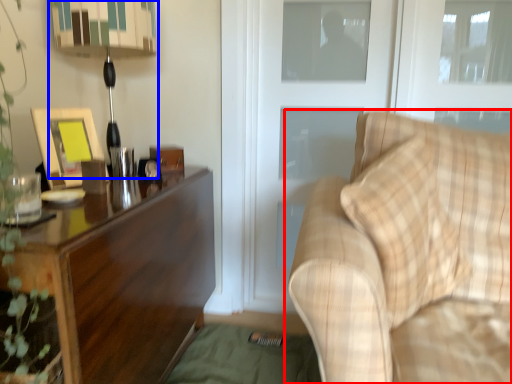
Question: Among these objects, which one is nearest to the camera, studio couch (highlighted by a red box) or table lamp (highlighted by a blue box)?

Choices:
 (A) studio couch
 (B) table lamp

Answer: (A)